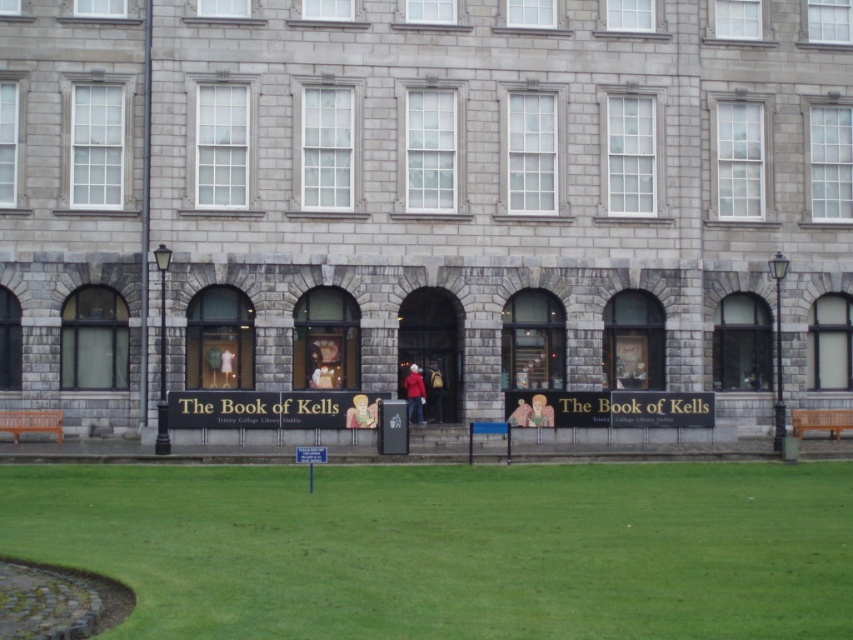
Question: Which point is closer to the camera?

Choices:
 (A) matte red jacket at center
 (B) matte yellow figure at center

Answer: (B)

Question: Is smooth beige figure at center above matte red jacket at center?

Choices:
 (A) yes
 (B) no

Answer: (B)

Question: Is wooden park bench at lower right smaller than matte yellow figure at center?

Choices:
 (A) no
 (B) yes

Answer: (A)

Question: Estimate the real-world distances between objects in this image. Which object is closer to the smooth beige figure at center?

Choices:
 (A) red matte coat at center
 (B) matte yellow figure at center
 (C) green grass at lower center

Answer: (B)

Question: Which point is farther to the camera?

Choices:
 (A) green grass at lower center
 (B) wooden bench at lower left

Answer: (B)

Question: Can you confirm if wooden bench at lower left is positioned to the right of wooden park bench at lower right?

Choices:
 (A) no
 (B) yes

Answer: (A)